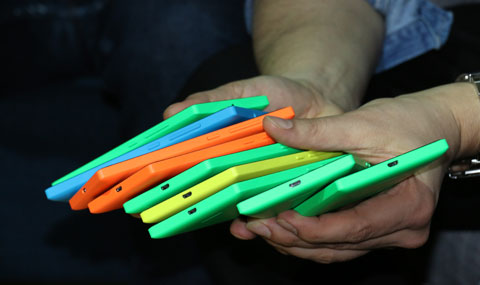
Find the location of a particular element. phone is located at coordinates (230, 194).